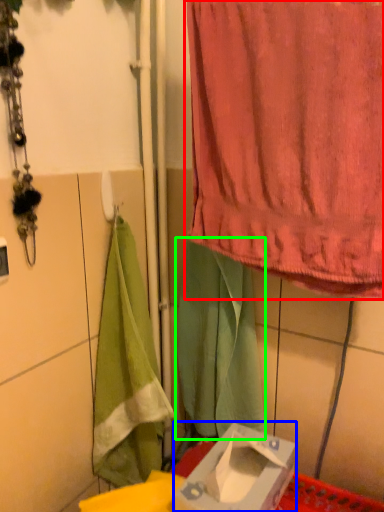
Question: Which is farther away from curtain (highlighted by a red box)? box (highlighted by a blue box) or cloth (highlighted by a green box)?

Choices:
 (A) box
 (B) cloth

Answer: (A)